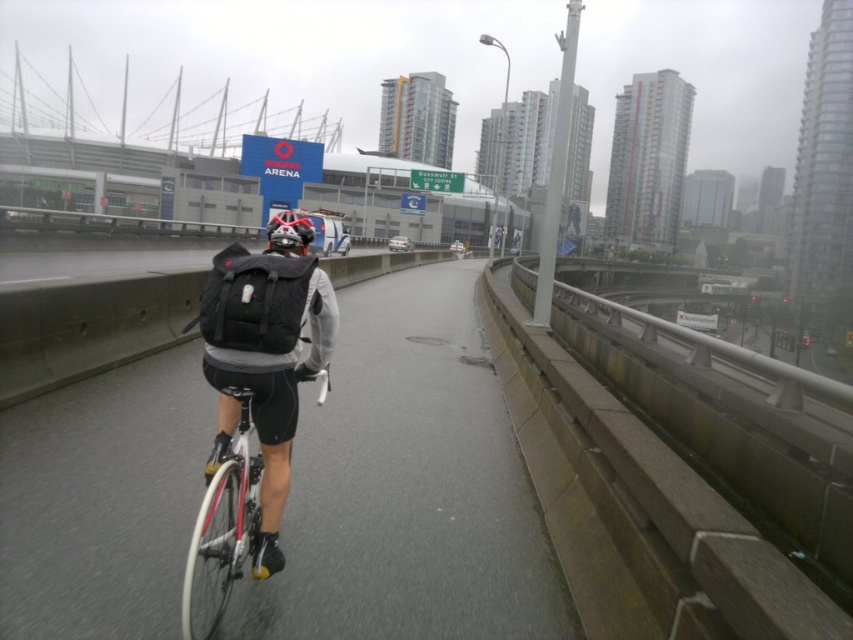
Consider the image. You are a delivery drone operator. Your drone needs to fly between the matte black backpack at center and the shiny black helmet at center. What is the minimum distance your drone must travel to move from one to the other?

The minimum distance the drone must travel is 71.44 feet between the matte black backpack at center and the shiny black helmet at center.

You are a delivery drone operator. Your drone is currently at coordinates 0.75, 0.48. You need to land on the white asphalt road at center. Is your current position close enough to land safely?

The white asphalt road at center is located at point (408,486). Your current position is (409,480), which is very close. The distance between your position and the road is minimal, so you can land safely.

You are a delivery drone operator. Your drone needs to land on the white asphalt road at center while avoiding the white matte bicycle at center. Can the drone safely land on the road without touching the bicycle?

The white asphalt road at center is larger in size than the white matte bicycle at center, so there is enough space for the drone to land safely on the road while avoiding the bicycle.